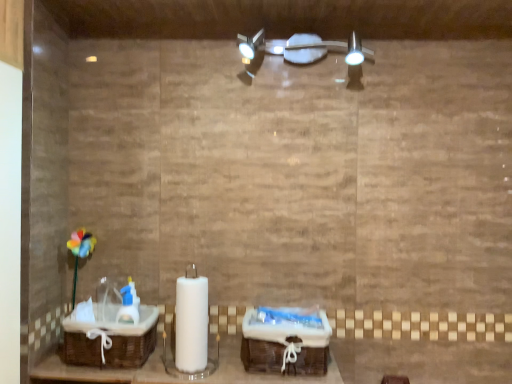
Question: Could you tell me if brown woven basket at lower left is facing satin nickel light fixture at upper center?

Choices:
 (A) no
 (B) yes

Answer: (A)

Question: Does brown woven basket at lower left have a smaller size compared to satin nickel light fixture at upper center?

Choices:
 (A) no
 (B) yes

Answer: (A)

Question: Is brown woven basket at lower left far from satin nickel light fixture at upper center?

Choices:
 (A) yes
 (B) no

Answer: (B)

Question: Is brown woven basket at lower left surrounding satin nickel light fixture at upper center?

Choices:
 (A) yes
 (B) no

Answer: (B)

Question: Considering the relative sizes of brown woven basket at lower left and satin nickel light fixture at upper center in the image provided, is brown woven basket at lower left wider than satin nickel light fixture at upper center?

Choices:
 (A) no
 (B) yes

Answer: (B)

Question: Is brown woven basket at lower left inside the boundaries of woven brown baskets at center, or outside?

Choices:
 (A) outside
 (B) inside

Answer: (A)

Question: From the image's perspective, is brown woven basket at lower left located above or below woven brown baskets at center?

Choices:
 (A) below
 (B) above

Answer: (B)

Question: Based on their positions, is brown woven basket at lower left located to the left or right of woven brown baskets at center?

Choices:
 (A) right
 (B) left

Answer: (B)

Question: Considering the positions of brown woven basket at lower left and woven brown baskets at center in the image, is brown woven basket at lower left taller or shorter than woven brown baskets at center?

Choices:
 (A) tall
 (B) short

Answer: (A)

Question: Looking at the image, does woven brown baskets at center seem bigger or smaller compared to satin nickel light fixture at upper center?

Choices:
 (A) small
 (B) big

Answer: (A)

Question: Would you say woven brown baskets at center is inside or outside satin nickel light fixture at upper center?

Choices:
 (A) inside
 (B) outside

Answer: (B)

Question: Visually, is woven brown baskets at center positioned to the left or to the right of satin nickel light fixture at upper center?

Choices:
 (A) right
 (B) left

Answer: (B)

Question: Considering the positions of woven brown baskets at center and satin nickel light fixture at upper center in the image, is woven brown baskets at center taller or shorter than satin nickel light fixture at upper center?

Choices:
 (A) short
 (B) tall

Answer: (A)

Question: From a real-world perspective, is brown woven basket at lower left above or below satin nickel light fixture at upper center?

Choices:
 (A) above
 (B) below

Answer: (B)

Question: In terms of width, does brown woven basket at lower left look wider or thinner when compared to satin nickel light fixture at upper center?

Choices:
 (A) wide
 (B) thin

Answer: (A)